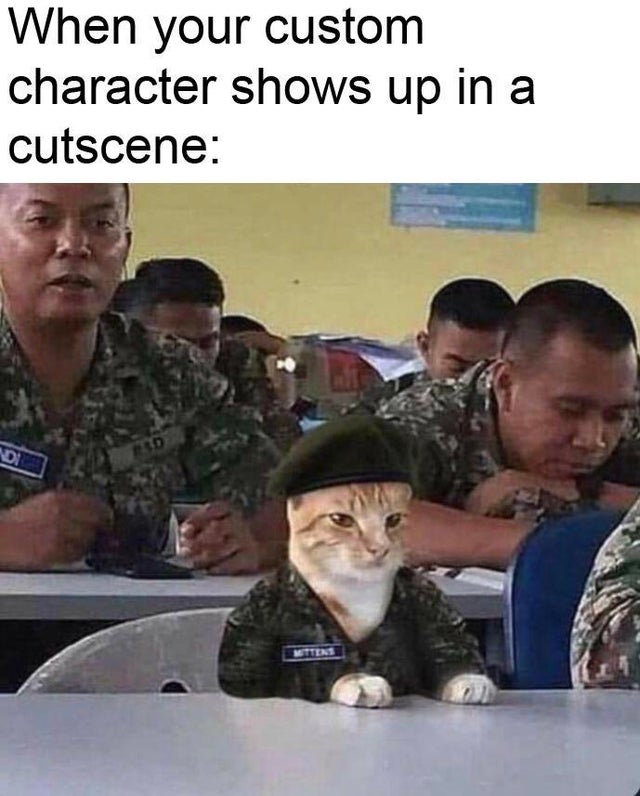
You are a GUI agent. You are given a task and a screenshot of the screen. Output one action in this format:
    pyautogui.click(x=<x>, y=<y>)
    Task: Click on the tables
    
    Given the screenshot: What is the action you would take?
    pyautogui.click(x=187, y=730), pyautogui.click(x=104, y=587)